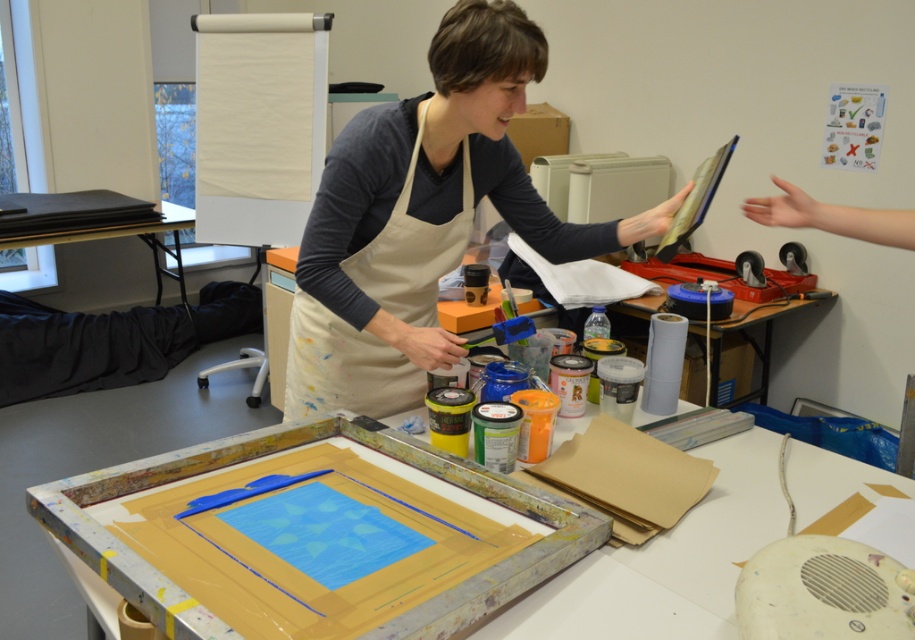
You are an artist trying to place a large canvas on the wooden table at center. The canvas is as wide as the beige cotton apron at center. Will the canvas fit on the table?

The wooden table at center is wider than the beige cotton apron at center, so the canvas, which is as wide as the apron, will fit on the table.

You are an art student who wants to place a new set of brushes on the table. Considering the size of the matte apron at center and the wooden table at center, will there be enough space on the table to place the brushes?

The matte apron at center has a smaller size compared to wooden table at center, so there should be enough space on the wooden table at center to place the brushes.

You are an art student observing the setup in the art studio. You notice two points marked on the table where the artist is working. The first point is at coordinates point (499,129) and the second is at point (375,384). If you were to walk towards the table, which point would you encounter first?

Point (499,129) is closer to the viewer than point (375,384), so you would encounter point (499,129) first as you approach the table.